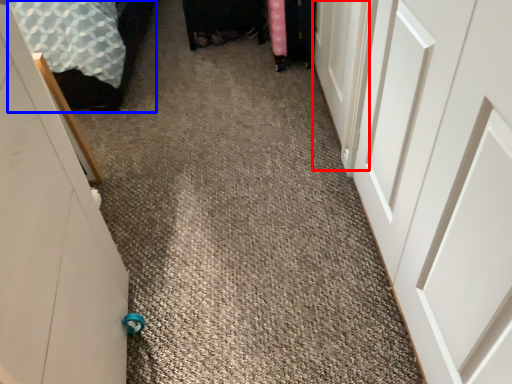
Question: Which of the following is the closest to the observer, door (highlighted by a red box) or bed (highlighted by a blue box)?

Choices:
 (A) door
 (B) bed

Answer: (A)